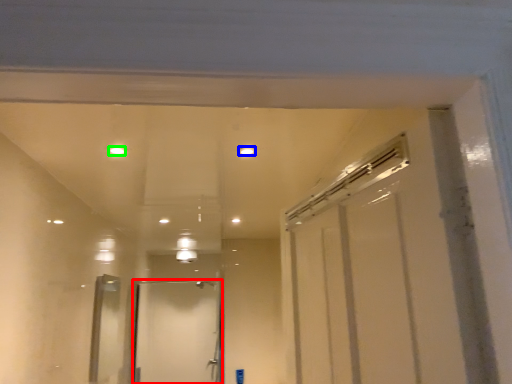
Question: Based on their relative distances, which object is farther from door (highlighted by a red box)? Choose from light (highlighted by a blue box) and light (highlighted by a green box).

Choices:
 (A) light
 (B) light

Answer: (A)